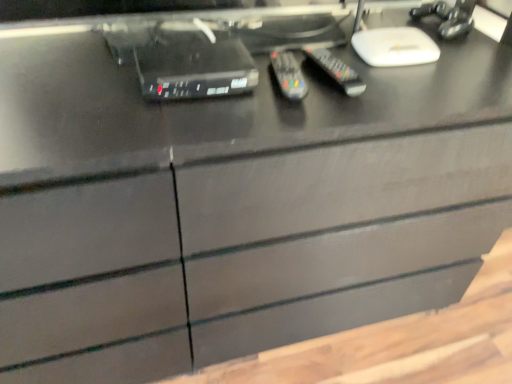
This screenshot has width=512, height=384. I want to click on vacant space situated on the left part of black plastic remote at center, placed as the 1th control when sorted from left to right, so click(x=200, y=102).